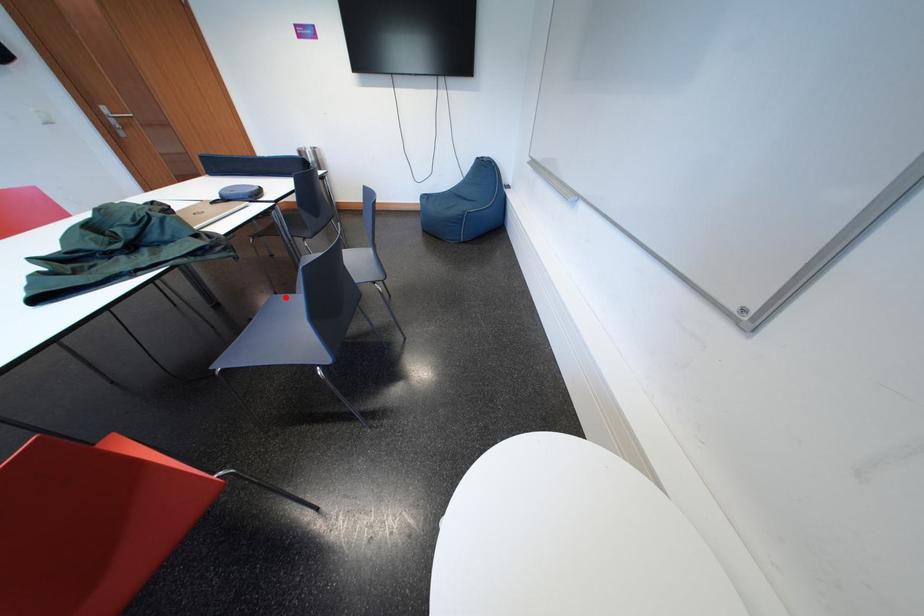
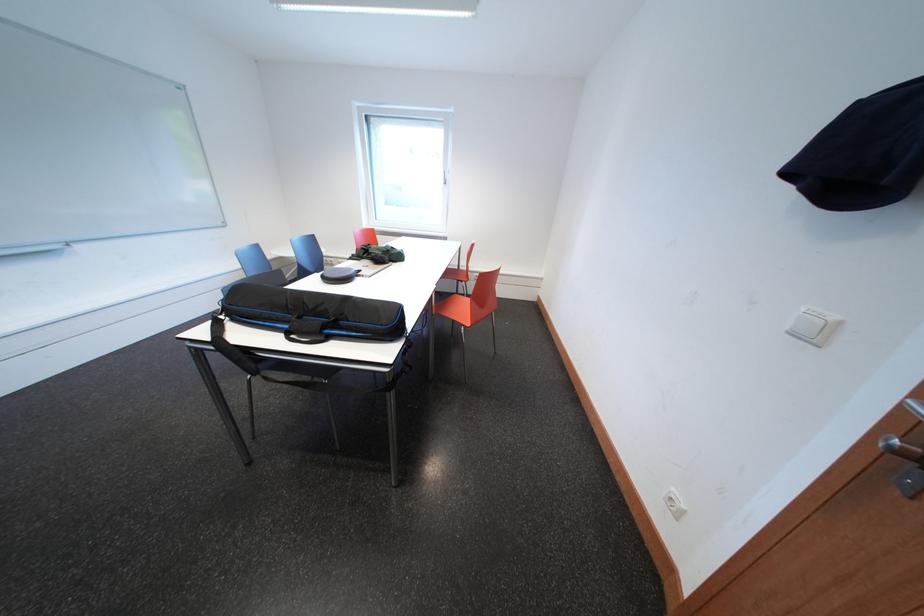
Question: I am providing you with two images of the same scene from different viewpoints. A red point is marked on the first image. Can you still see the location of the red point in image 2?

Choices:
 (A) Yes
 (B) No

Answer: (B)